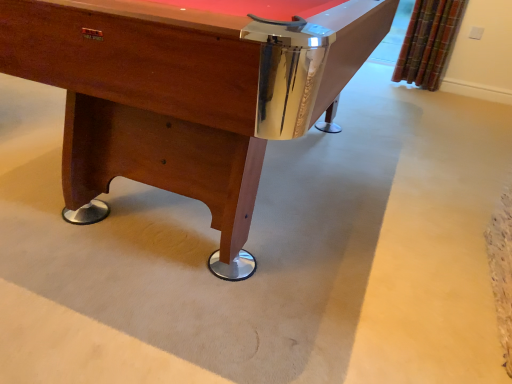
What do you see at coordinates (184, 96) in the screenshot? This screenshot has width=512, height=384. I see `wooden pool table at center` at bounding box center [184, 96].

The width and height of the screenshot is (512, 384). I want to click on wooden pool table at center, so click(x=184, y=96).

You are a GUI agent. You are given a task and a screenshot of the screen. Output one action in this format:
    pyautogui.click(x=<x>, y=<y>)
    Task: Click on the wooden pool table at center
    
    Given the screenshot: What is the action you would take?
    pyautogui.click(x=184, y=96)